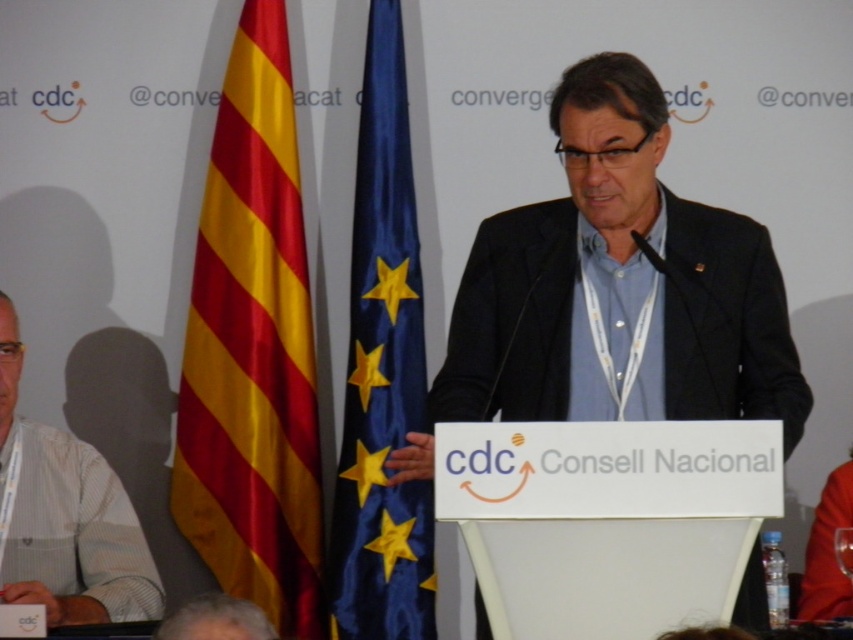
Is black matte suit at center below yellow/red striped fabric at left?

No, black matte suit at center is not below yellow/red striped fabric at left.

Find the location of `black matte suit at center`. black matte suit at center is located at coordinates (619, 285).

Does point (480, 381) come in front of point (332, 568)?

That is True.

Where is `black matte suit at center`? black matte suit at center is located at coordinates (619, 285).

Who is more forward, (755, 573) or (373, 54)?

Point (755, 573) is more forward.

Identify the location of black matte suit at center. The image size is (853, 640). (619, 285).

Can you confirm if yellow/red striped fabric at left is thinner than white striped shirt at lower left?

Yes.

Can you confirm if yellow/red striped fabric at left is smaller than white striped shirt at lower left?

Yes.

Locate an element on the screen. This screenshot has width=853, height=640. yellow/red striped fabric at left is located at coordinates (253, 349).